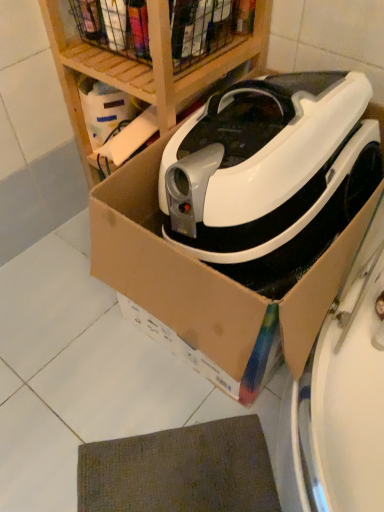
Describe the element at coordinates (209, 287) in the screenshot. I see `cardboard box at center` at that location.

Describe the element at coordinates (144, 68) in the screenshot. The height and width of the screenshot is (512, 384). I see `wooden at upper center` at that location.

Identify the location of cardboard box at center. (209, 287).

From a real-world perspective, is cardboard box at center physically located above or below wooden at upper center?

cardboard box at center is below wooden at upper center.

Measure the distance between cardboard box at center and wooden at upper center.

13.81 inches.

Is cardboard box at center not near wooden at upper center?

No.

Considering the sizes of cardboard box at center and wooden at upper center in the image, is cardboard box at center bigger or smaller than wooden at upper center?

cardboard box at center is bigger than wooden at upper center.

Considering the relative sizes of cardboard box at center and brown textured mat at lower center in the image provided, is cardboard box at center wider than brown textured mat at lower center?

Yes, cardboard box at center is wider than brown textured mat at lower center.

Considering the positions of objects cardboard box at center and brown textured mat at lower center in the image provided, who is behind, cardboard box at center or brown textured mat at lower center?

brown textured mat at lower center is further away from the camera.

Find the location of a particular element. mat on the left of cardboard box at center is located at coordinates (180, 470).

Between cardboard box at center and brown textured mat at lower center, which one has smaller size?

brown textured mat at lower center is smaller.

You are a GUI agent. You are given a task and a screenshot of the screen. Output one action in this format:
    pyautogui.click(x=<x>, y=<y>)
    Task: Click on the shelf beneath the white glossy robotic vacuum cleaner at center (from a real-world perspective)
    This screenshot has height=512, width=384.
    Given the screenshot: What is the action you would take?
    pyautogui.click(x=144, y=68)

Is white glossy robotic vacuum cleaner at center inside or outside of wooden at upper center?

white glossy robotic vacuum cleaner at center lies outside wooden at upper center.

From the image's perspective, is white glossy robotic vacuum cleaner at center located beneath wooden at upper center?

Yes, from the image's perspective, white glossy robotic vacuum cleaner at center is beneath wooden at upper center.

From a real-world perspective, between white glossy robotic vacuum cleaner at center and wooden at upper center, who is vertically lower?

wooden at upper center, from a real-world perspective.

Which object is positioned more to the right, wooden at upper center or brown textured mat at lower center?

From the viewer's perspective, brown textured mat at lower center appears more on the right side.

Between point (208, 65) and point (215, 472), which one is positioned in front?

The point (215, 472) is closer to the camera.

Is wooden at upper center turned away from brown textured mat at lower center?

No, wooden at upper center is not facing away from brown textured mat at lower center.

Is cardboard box at center closer to the viewer compared to white glossy robotic vacuum cleaner at center?

Yes, the depth of cardboard box at center is less than that of white glossy robotic vacuum cleaner at center.

Is cardboard box at center directly adjacent to white glossy robotic vacuum cleaner at center?

No, cardboard box at center is not making contact with white glossy robotic vacuum cleaner at center.

Does cardboard box at center turn towards white glossy robotic vacuum cleaner at center?

Yes.

Is wooden at upper center turned away from white glossy robotic vacuum cleaner at center?

wooden at upper center does not have its back to white glossy robotic vacuum cleaner at center.

In order to click on home appliance on the right of wooden at upper center in this screenshot , I will do `click(270, 172)`.

Considering the sizes of objects wooden at upper center and white glossy robotic vacuum cleaner at center in the image provided, who is taller, wooden at upper center or white glossy robotic vacuum cleaner at center?

wooden at upper center.

From the image's perspective, is wooden at upper center located above or below white glossy robotic vacuum cleaner at center?

Clearly, from the image's perspective, wooden at upper center is above white glossy robotic vacuum cleaner at center.

Considering the sizes of objects wooden at upper center and cardboard box at center in the image provided, who is taller, wooden at upper center or cardboard box at center?

Standing taller between the two is wooden at upper center.

Considering their positions, is wooden at upper center located in front of or behind cardboard box at center?

wooden at upper center is behind cardboard box at center.

Would you say wooden at upper center is a long distance from cardboard box at center?

They are positioned close to each other.

Image resolution: width=384 pixels, height=512 pixels. Find the location of `cardboard box that is below the wooden at upper center (from the image's perspective)`. cardboard box that is below the wooden at upper center (from the image's perspective) is located at coordinates (209, 287).

At what (x,y) coordinates should I click in order to perform the action: click on cardboard box on the right of brown textured mat at lower center. Please return your answer as a coordinate pair (x, y). The height and width of the screenshot is (512, 384). Looking at the image, I should click on (209, 287).

Which object lies nearer to the anchor point brown textured mat at lower center, cardboard box at center or white glossy robotic vacuum cleaner at center?

Among the two, cardboard box at center is located nearer to brown textured mat at lower center.

From the image, which object appears to be nearer to white glossy robotic vacuum cleaner at center, brown textured mat at lower center or wooden at upper center?

wooden at upper center lies closer to white glossy robotic vacuum cleaner at center than the other object.

Based on their spatial positions, is white glossy robotic vacuum cleaner at center or cardboard box at center further from wooden at upper center?

cardboard box at center.

When comparing their distances from wooden at upper center, does cardboard box at center or white glossy robotic vacuum cleaner at center seem closer?

white glossy robotic vacuum cleaner at center is closer to wooden at upper center.

From the image, which object appears to be nearer to cardboard box at center, wooden at upper center or white glossy robotic vacuum cleaner at center?

The object closer to cardboard box at center is white glossy robotic vacuum cleaner at center.

Which object lies further to the anchor point white glossy robotic vacuum cleaner at center, brown textured mat at lower center or cardboard box at center?

brown textured mat at lower center is further to white glossy robotic vacuum cleaner at center.

From the image, which object appears to be nearer to white glossy robotic vacuum cleaner at center, cardboard box at center or brown textured mat at lower center?

cardboard box at center is closer to white glossy robotic vacuum cleaner at center.

Which object lies further to the anchor point wooden at upper center, white glossy robotic vacuum cleaner at center or brown textured mat at lower center?

brown textured mat at lower center is further to wooden at upper center.

Locate an element on the screen. cardboard box between wooden at upper center and brown textured mat at lower center in the up-down direction is located at coordinates (209, 287).

This screenshot has width=384, height=512. I want to click on cardboard box that lies between white glossy robotic vacuum cleaner at center and brown textured mat at lower center from top to bottom, so click(209, 287).

At what (x,y) coordinates should I click in order to perform the action: click on home appliance between wooden at upper center and brown textured mat at lower center from top to bottom. Please return your answer as a coordinate pair (x, y). This screenshot has height=512, width=384. Looking at the image, I should click on (270, 172).

Identify the location of home appliance between wooden at upper center and cardboard box at center in the up-down direction. (270, 172).